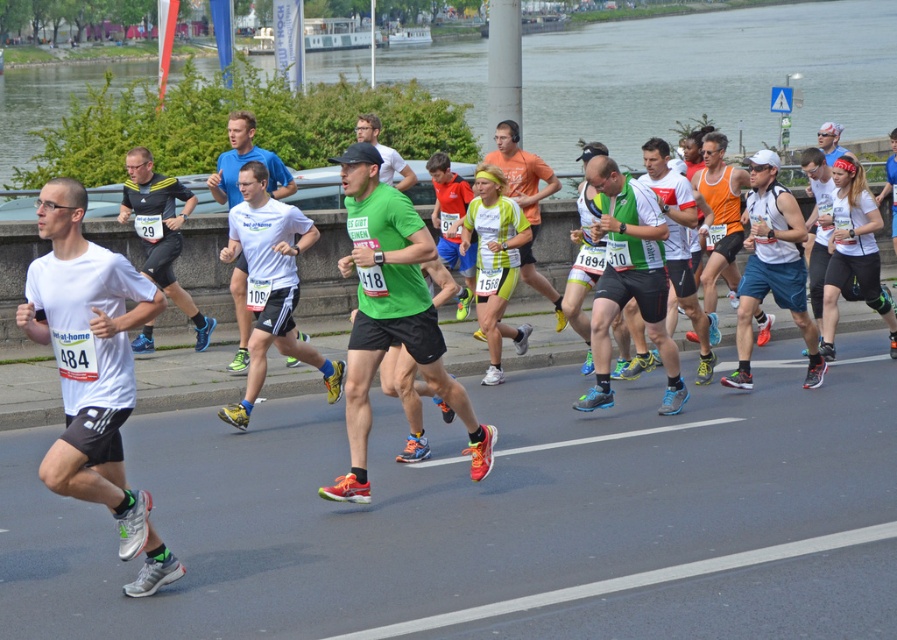
Question: From the image, what is the correct spatial relationship of white matte tank top at center in relation to white matte shirt at center?

Choices:
 (A) right
 (B) left

Answer: (A)

Question: Is white matte tank top at center positioned behind white matte shirt at center?

Choices:
 (A) no
 (B) yes

Answer: (B)

Question: Based on their relative distances, which object is nearer to the transparent water at upper center?

Choices:
 (A) matte black shirt at left
 (B) white matte tank top at center
 (C) yellow-green jersey at center

Answer: (C)

Question: Which of these objects is positioned closest to the white matte shirt at center?

Choices:
 (A) matte black shirt at left
 (B) white matte tank top at center
 (C) yellow-green jersey at center
 (D) neon green jersey at center

Answer: (A)

Question: Is transparent water at upper center thinner than green matte shirt at center?

Choices:
 (A) yes
 (B) no

Answer: (B)

Question: Which point appears closest to the camera in this image?

Choices:
 (A) (185, 216)
 (B) (830, 352)

Answer: (A)